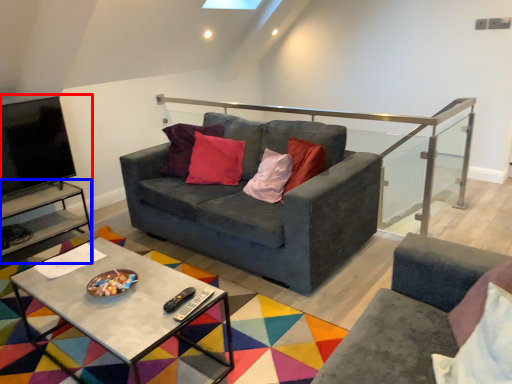
Question: Which point is further to the camera, entertainment center (highlighted by a red box) or side table (highlighted by a blue box)?

Choices:
 (A) entertainment center
 (B) side table

Answer: (B)